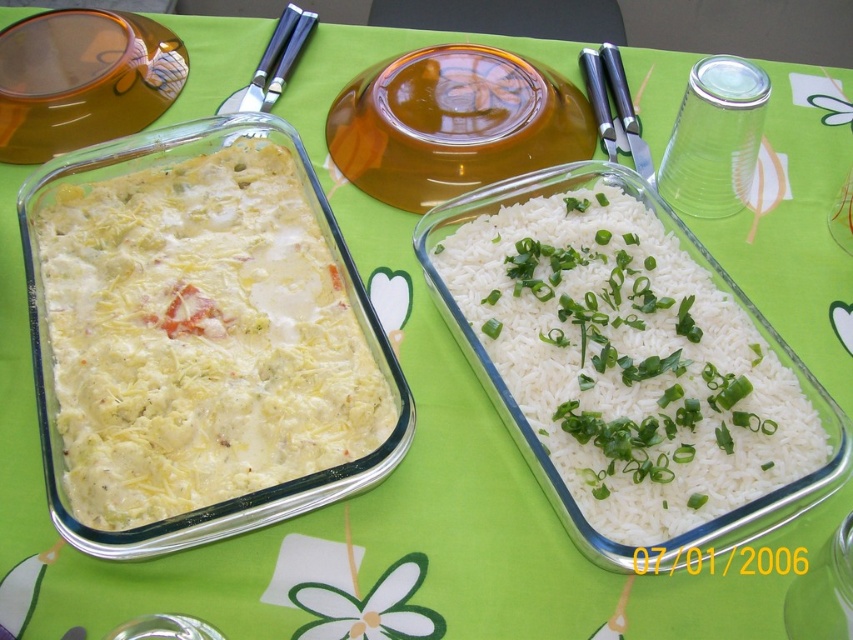
Does white creamy cheese casserole at left have a greater width compared to white matte rice at center?

Yes.

Is point (241, 276) positioned behind point (619, 488)?

Yes.

Where is `white creamy cheese casserole at left`? white creamy cheese casserole at left is located at coordinates (200, 337).